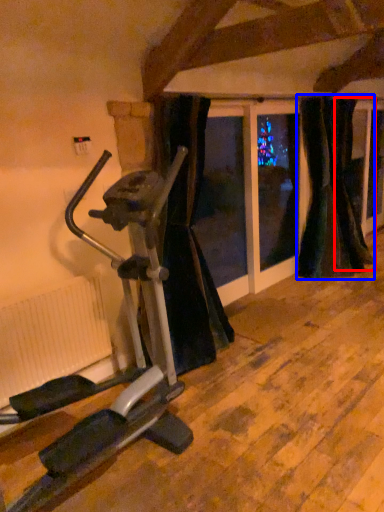
Question: Which object is further to the camera taking this photo, curtain (highlighted by a red box) or curtain (highlighted by a blue box)?

Choices:
 (A) curtain
 (B) curtain

Answer: (A)